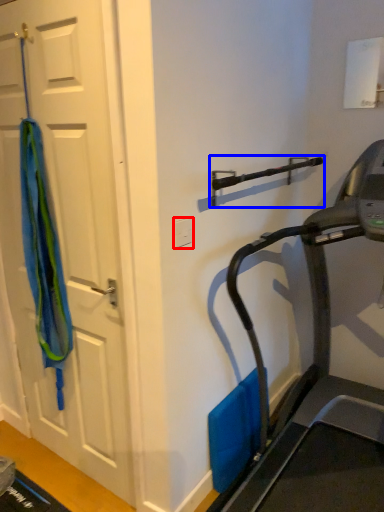
Question: Which object appears farthest to the camera in this image, electric outlet (highlighted by a red box) or door handle (highlighted by a blue box)?

Choices:
 (A) electric outlet
 (B) door handle

Answer: (A)